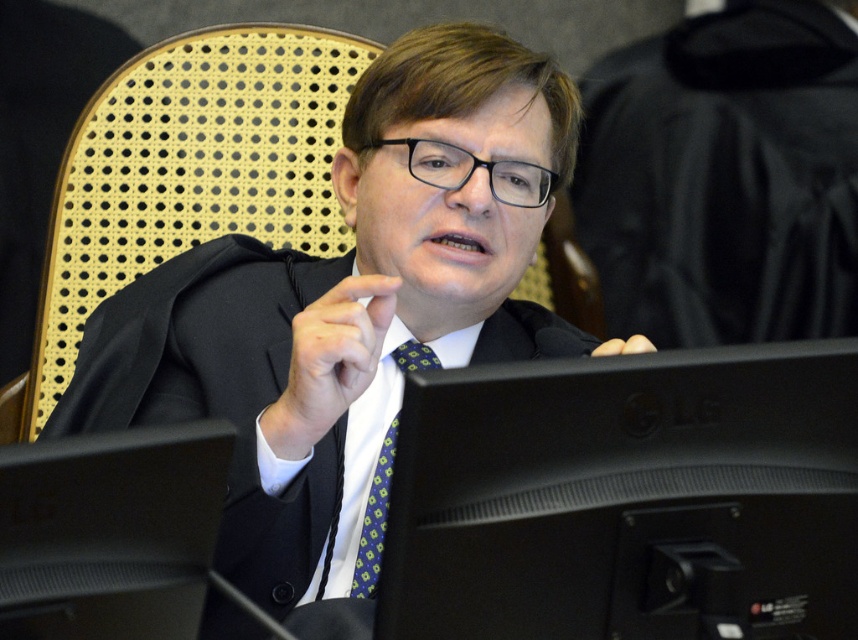
Is black matte suit at center positioned behind black plastic monitor at center?

Yes.

The height and width of the screenshot is (640, 858). What do you see at coordinates (349, 308) in the screenshot?
I see `black matte suit at center` at bounding box center [349, 308].

Where is `black matte suit at center`? black matte suit at center is located at coordinates (349, 308).

Who is taller, black plastic monitor at center or green checkered tie at center?

Standing taller between the two is green checkered tie at center.

Does black plastic monitor at center have a greater height compared to green checkered tie at center?

Incorrect, black plastic monitor at center's height is not larger of green checkered tie at center's.

At what (x,y) coordinates should I click in order to perform the action: click on black plastic monitor at center. Please return your answer as a coordinate pair (x, y). This screenshot has width=858, height=640. Looking at the image, I should click on (627, 497).

Which is below, black matte suit at center or green checkered tie at center?

Positioned lower is green checkered tie at center.

Between black matte suit at center and green checkered tie at center, which one is positioned higher?

black matte suit at center is above.

You are a GUI agent. You are given a task and a screenshot of the screen. Output one action in this format:
    pyautogui.click(x=<x>, y=<y>)
    Task: Click on the black matte suit at center
    
    Given the screenshot: What is the action you would take?
    pyautogui.click(x=349, y=308)